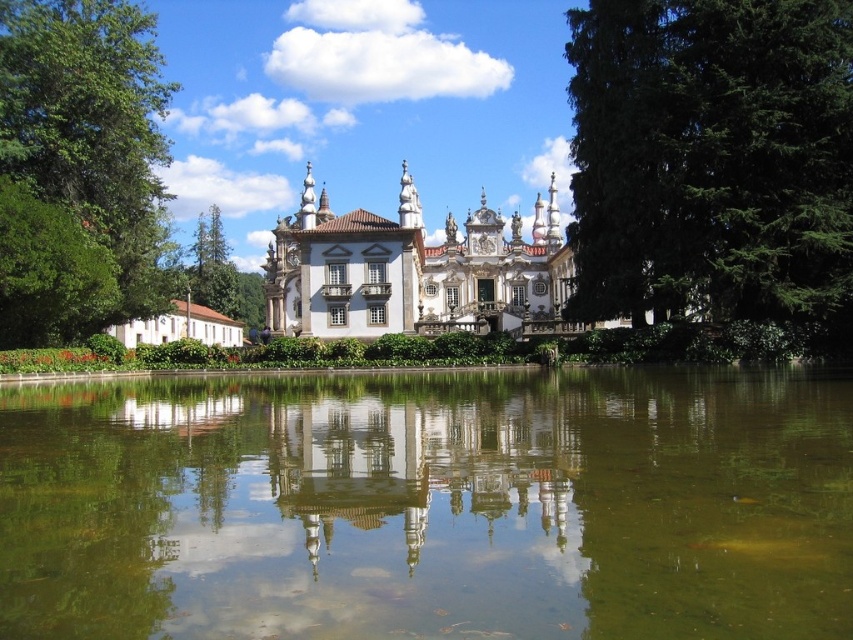
Based on the photo, between transparent glass reflection at center and white ornate palace at center, which one appears on the left side from the viewer's perspective?

From the viewer's perspective, white ornate palace at center appears more on the left side.

Which is more to the right, transparent glass reflection at center or white ornate palace at center?

transparent glass reflection at center is more to the right.

Identify the location of transparent glass reflection at center. Image resolution: width=853 pixels, height=640 pixels. (428, 480).

This screenshot has width=853, height=640. What are the coordinates of `transparent glass reflection at center` in the screenshot? It's located at (428, 480).

Can you confirm if green textured tree at right is positioned to the left of transparent glass reflection at center?

No, green textured tree at right is not to the left of transparent glass reflection at center.

Image resolution: width=853 pixels, height=640 pixels. Identify the location of green textured tree at right. 714,160.

In order to click on green textured tree at right in this screenshot , I will do `click(714, 160)`.

Does green leafy tree at left appear on the right side of white ornate palace at center?

Incorrect, green leafy tree at left is not on the right side of white ornate palace at center.

The width and height of the screenshot is (853, 640). What do you see at coordinates (78, 168) in the screenshot? I see `green leafy tree at left` at bounding box center [78, 168].

Where is `green leafy tree at left`? green leafy tree at left is located at coordinates (78, 168).